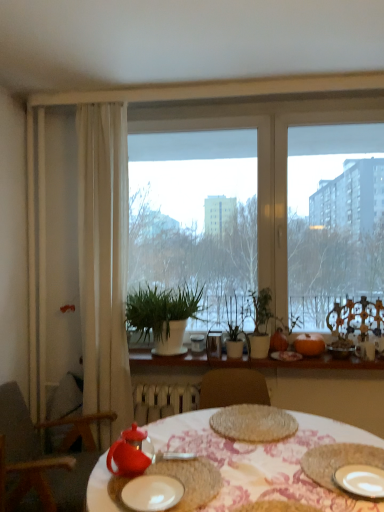
The height and width of the screenshot is (512, 384). In order to click on free space between white matte plate at center, marked as the first plate in a left-to-right arrangement, and woven mat at center in this screenshot , I will do click(215, 457).